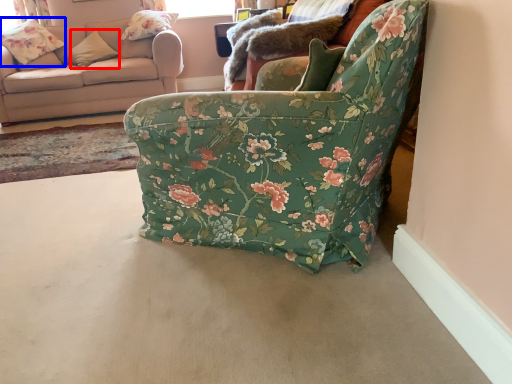
Question: Among these objects, which one is farthest to the camera, pillow (highlighted by a red box) or flower (highlighted by a blue box)?

Choices:
 (A) pillow
 (B) flower

Answer: (A)